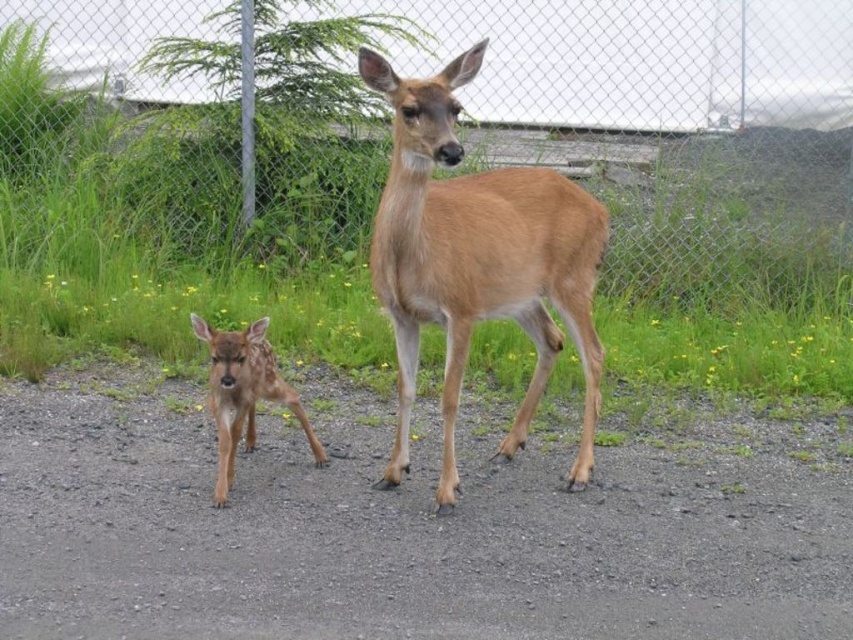
You are a photographer trying to capture both the wire mesh fence at upper center and the spotted fur fawn at lower left in the same frame. Based on their positions and sizes, can you determine which one will appear larger in your photo?

The wire mesh fence at upper center is taller than the spotted fur fawn at lower left, so the wire mesh fence at upper center will appear larger in the photo.

You are a photographer standing on the gravel path and want to take a photo of the wire mesh fence at upper center and the light brown fur at center. Which object will appear closer to you in the photo?

The wire mesh fence at upper center will appear closer to you in the photo because it is further to the viewer than the light brown fur at center.

You are a photographer trying to capture both the adult deer and the fawn in a single shot. The adult deer is at point (521,294) and the fawn is at point (508,68). Since you want to ensure both are in focus, which deer should you focus on first to make sure they are both clear in the photo?

You should focus on the fawn at point (508,68) first because it is closer to the viewer than the adult deer at point (521,294). By focusing on the closer subject, the adult deer will also be in focus due to the depth of field.